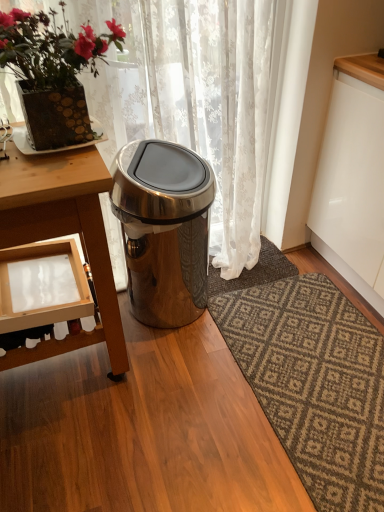
Find the location of a particular element. This screenshot has width=384, height=512. vacant area on top of dark gray textured rug at center (from a real-world perspective) is located at coordinates (243, 266).